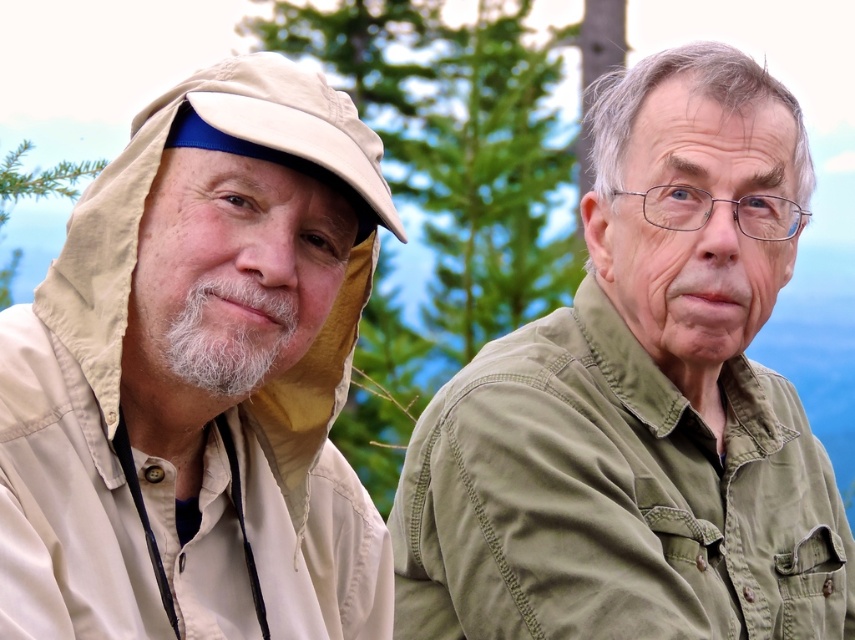
Is beige fabric hat at upper left to the left of green cotton shirt at right from the viewer's perspective?

Indeed, beige fabric hat at upper left is positioned on the left side of green cotton shirt at right.

Is beige fabric hat at upper left shorter than green cotton shirt at right?

Yes, beige fabric hat at upper left is shorter than green cotton shirt at right.

Is point (376, 588) behind point (616, 300)?

No.

Locate an element on the screen. beige fabric hat at upper left is located at coordinates (199, 378).